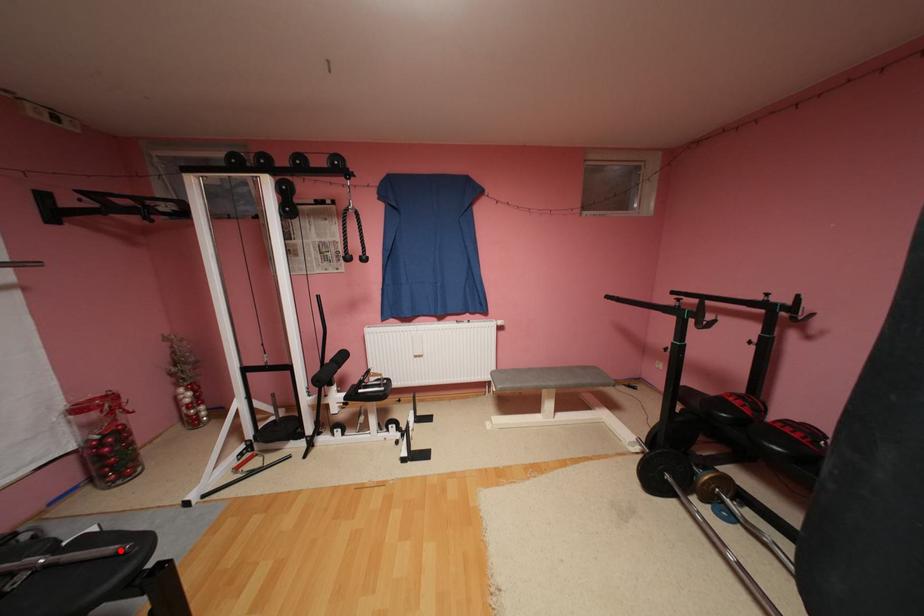
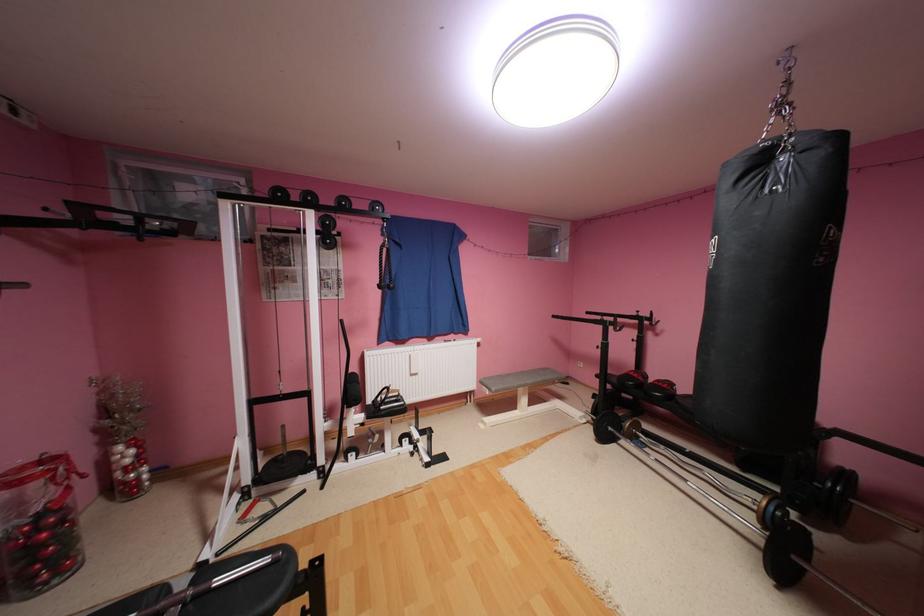
Question: I am providing you with two images of the same scene from different viewpoints. A red point is marked on the first image. Can you still see the location of the red point in image 2?

Choices:
 (A) Yes
 (B) No

Answer: (A)